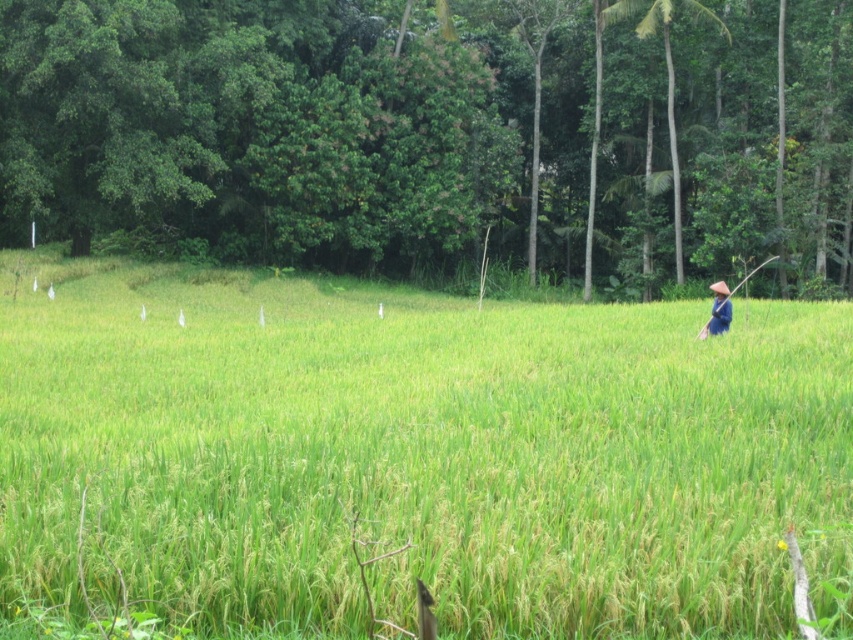
Does green grassy field at center appear on the right side of brown straw hat at right?

In fact, green grassy field at center is to the left of brown straw hat at right.

Is green grassy field at center thinner than brown straw hat at right?

No.

Which is in front, point (61, 454) or point (717, 324)?

Point (61, 454) is in front.

Locate an element on the screen. The width and height of the screenshot is (853, 640). green grassy field at center is located at coordinates (415, 458).